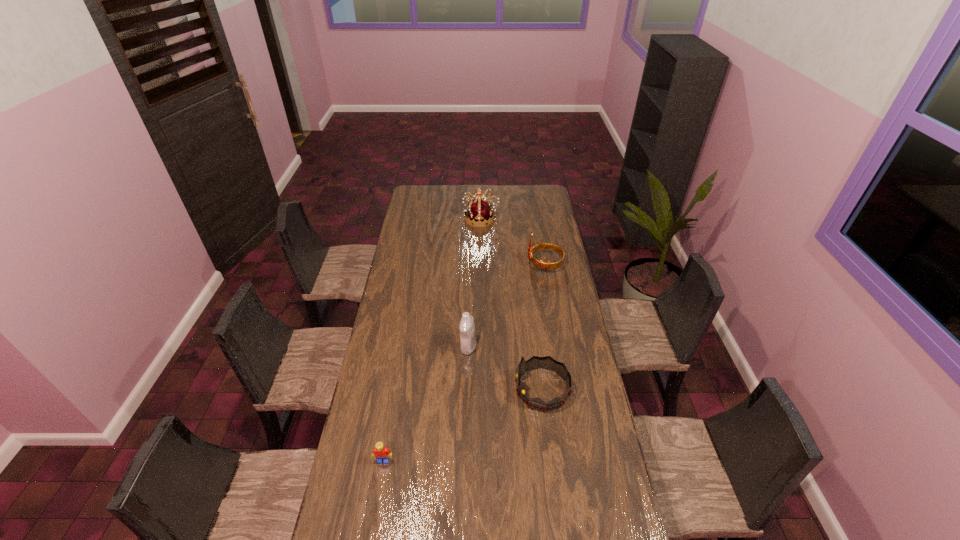
You are a GUI agent. You are given a task and a screenshot of the screen. Output one action in this format:
    pyautogui.click(x=<x>, y=<y>)
    Task: Click on the farthest object
    This screenshot has height=540, width=960.
    Given the screenshot: What is the action you would take?
    pyautogui.click(x=479, y=212)

Where is `the farthest tiara`? The image size is (960, 540). the farthest tiara is located at coordinates (479, 212).

Where is `the fourth nearest object`? The width and height of the screenshot is (960, 540). the fourth nearest object is located at coordinates (541, 264).

What are the coordinates of `the third nearest object` in the screenshot? It's located at (466, 326).

Find the location of `the second shortest object`. the second shortest object is located at coordinates (547, 362).

Image resolution: width=960 pixels, height=540 pixels. Identify the location of the fourth farthest object. (547, 362).

At what (x,y) coordinates should I click in order to perform the action: click on the leftmost object. Please return your answer as a coordinate pair (x, y). Looking at the image, I should click on (381, 453).

At what (x,y) coordinates should I click in order to perform the action: click on the shortest object. Please return your answer as a coordinate pair (x, y). This screenshot has width=960, height=540. Looking at the image, I should click on (381, 453).

The width and height of the screenshot is (960, 540). I want to click on vacant region located 0.270m on the front-facing side of the farthest object, so click(x=419, y=219).

The height and width of the screenshot is (540, 960). What are the coordinates of `free region located on the front-facing side of the farthest object` in the screenshot? It's located at (415, 219).